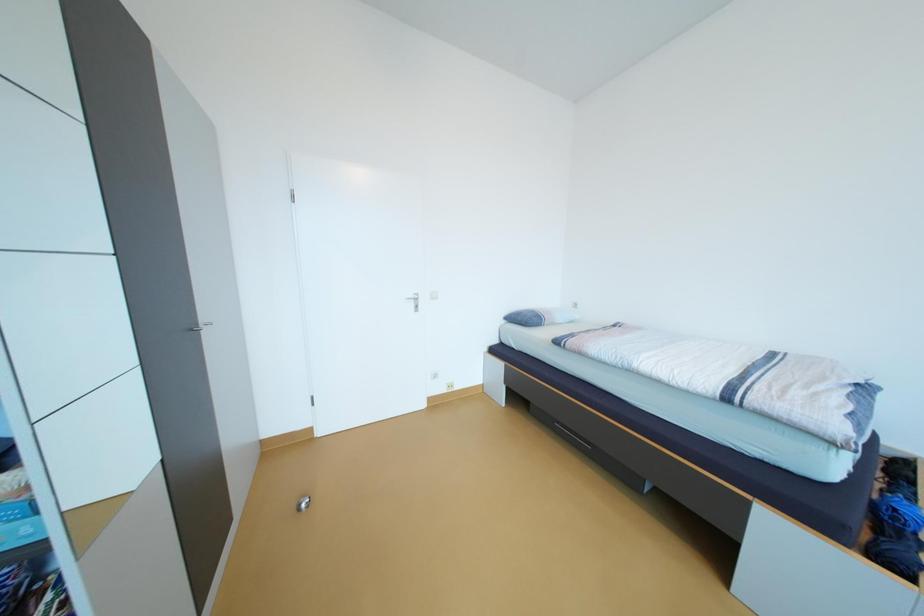
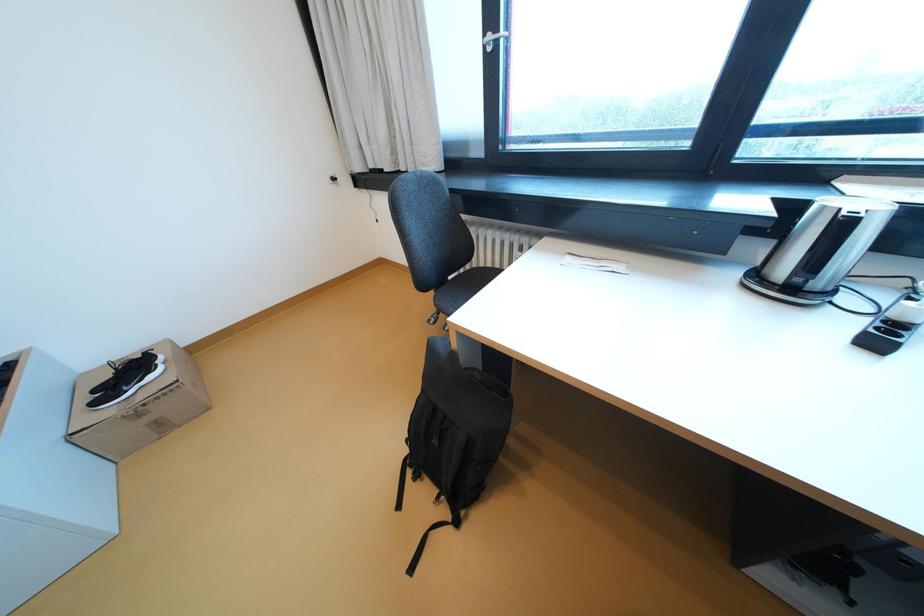
First-person continuous shooting, in which direction is the camera rotating?

The camera's rotation is toward right-down.